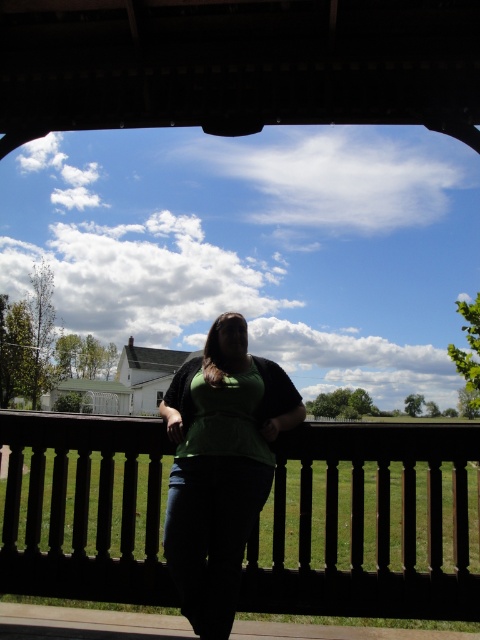
Question: Which point appears closest to the camera in this image?

Choices:
 (A) (379, 429)
 (B) (216, 518)

Answer: (B)

Question: Does dark brown wooden porch at center have a lesser width compared to green matte shirt at center?

Choices:
 (A) yes
 (B) no

Answer: (A)

Question: Where is dark brown wooden porch at center located in relation to green matte shirt at center in the image?

Choices:
 (A) below
 (B) above

Answer: (A)

Question: Among these points, which one is farthest from the camera?

Choices:
 (A) (16, 470)
 (B) (199, 592)

Answer: (A)

Question: Which of the following is the farthest from the observer?

Choices:
 (A) green matte shirt at center
 (B) dark brown wooden porch at center

Answer: (B)

Question: Can you confirm if dark brown wooden porch at center is positioned below green matte shirt at center?

Choices:
 (A) no
 (B) yes

Answer: (B)